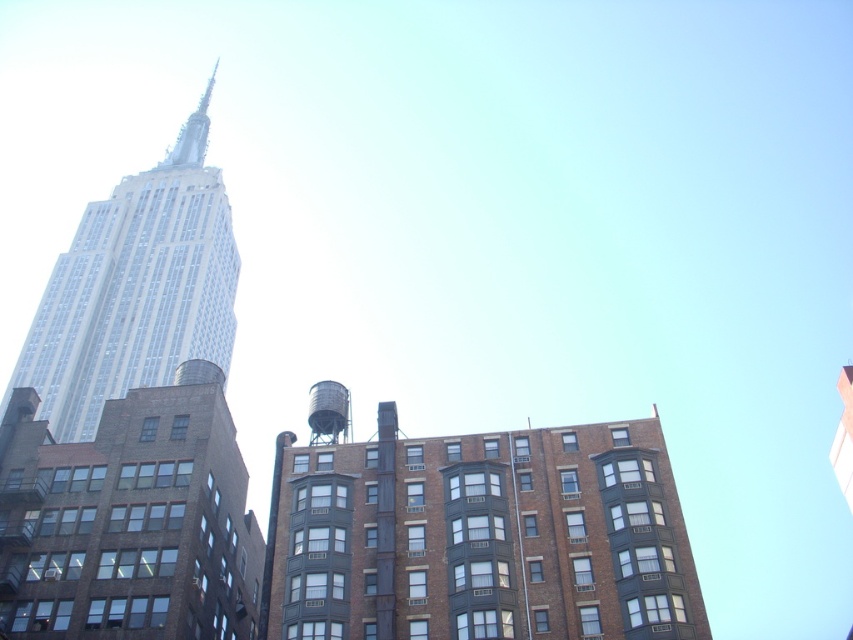
Between white glass tower at left and metallic gray water tower at center, which one appears on the left side from the viewer's perspective?

white glass tower at left is more to the left.

Does white glass tower at left have a lesser width compared to metallic gray water tower at center?

No, white glass tower at left is not thinner than metallic gray water tower at center.

Between point (231, 240) and point (341, 424), which one is positioned in front?

Point (341, 424)

This screenshot has width=853, height=640. In order to click on white glass tower at left in this screenshot , I will do `click(135, 289)`.